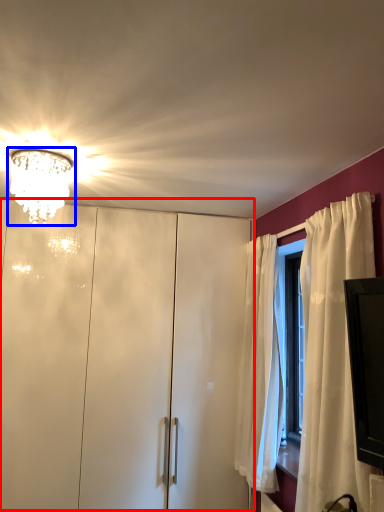
Question: Which of the following is the closest to the observer, dresser (highlighted by a red box) or lamp (highlighted by a blue box)?

Choices:
 (A) dresser
 (B) lamp

Answer: (B)